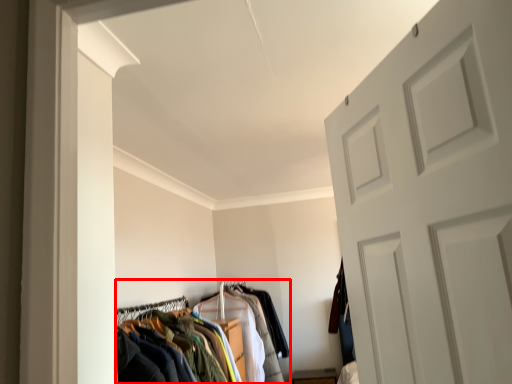
Question: From the image, what is the correct spatial relationship of closet (annotated by the red box) in relation to clothing?

Choices:
 (A) right
 (B) left

Answer: (B)